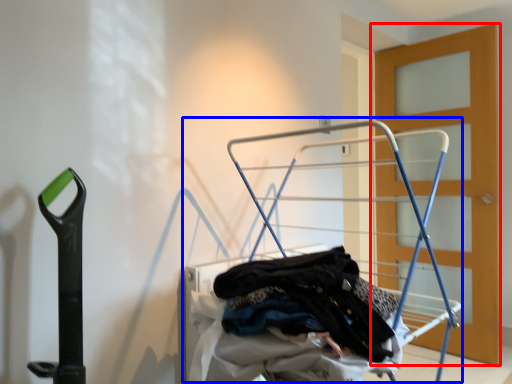
Question: Which object is further to the camera taking this photo, door (highlighted by a red box) or baby carriage (highlighted by a blue box)?

Choices:
 (A) door
 (B) baby carriage

Answer: (A)